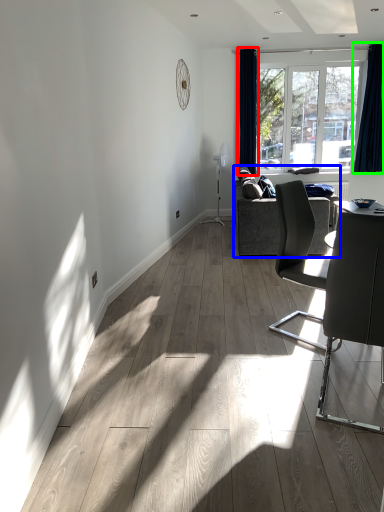
Question: Which is farther away from curtain (highlighted by a red box)? studio couch (highlighted by a blue box) or curtain (highlighted by a green box)?

Choices:
 (A) studio couch
 (B) curtain

Answer: (A)